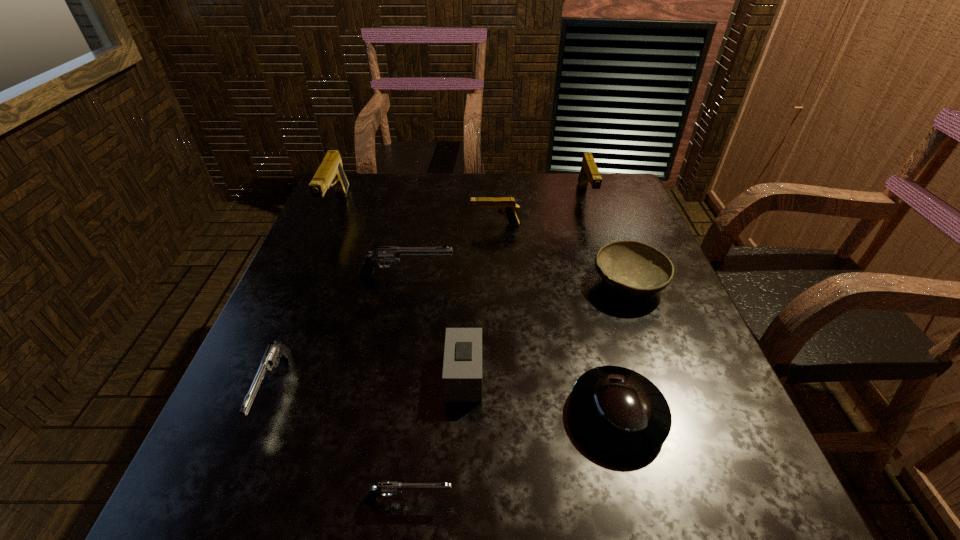
Locate an element on the screen. the biggest tan pistol is located at coordinates (330, 173).

At what (x,y) coordinates should I click in order to perform the action: click on the leftmost pistol. Please return your answer as a coordinate pair (x, y). The width and height of the screenshot is (960, 540). Looking at the image, I should click on (330, 173).

Where is `the second tallest pistol`? The width and height of the screenshot is (960, 540). the second tallest pistol is located at coordinates (589, 173).

Locate an element on the screen. This screenshot has height=540, width=960. the rightmost pistol is located at coordinates tap(589, 173).

The height and width of the screenshot is (540, 960). Identify the location of the third nearest pistol. (390, 254).

At what (x,y) coordinates should I click in order to perform the action: click on the biggest silver pistol. Please return your answer as a coordinate pair (x, y). The image size is (960, 540). Looking at the image, I should click on (390, 254).

At what (x,y) coordinates should I click in order to perform the action: click on the second tan pistol from left to right. Please return your answer as a coordinate pair (x, y). This screenshot has height=540, width=960. Looking at the image, I should click on (507, 205).

The image size is (960, 540). Find the location of `the smallest tan pistol`. the smallest tan pistol is located at coordinates (507, 205).

I want to click on alarm clock, so click(462, 364).

Where is `the eighth object from right to left`? The image size is (960, 540). the eighth object from right to left is located at coordinates (276, 350).